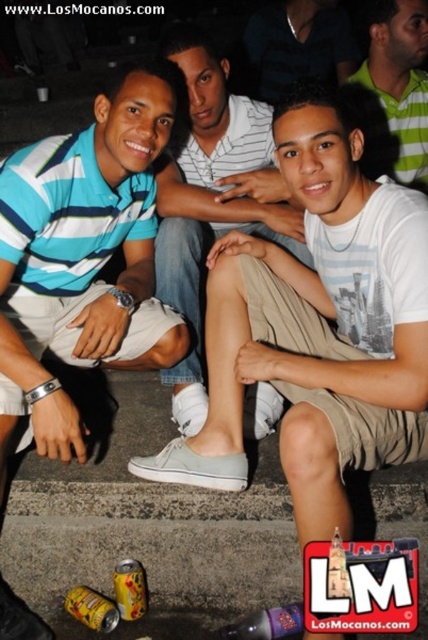
You are a photographer trying to capture a candid shot of the blue striped polo shirt at left and the white cotton shirt at center. Since you want to ensure both are in frame, which direction should you position your camera relative to the group?

The blue striped polo shirt at left is positioned on the left side of the white cotton shirt at center, so you should position your camera to the left of the group to include both in the frame.

Based on the scene description, can you determine if the white canvas shoe at lower left is located below the blue striped polo shirt at left?

Yes, the white canvas shoe at lower left is positioned under the blue striped polo shirt at left according to the objects description.